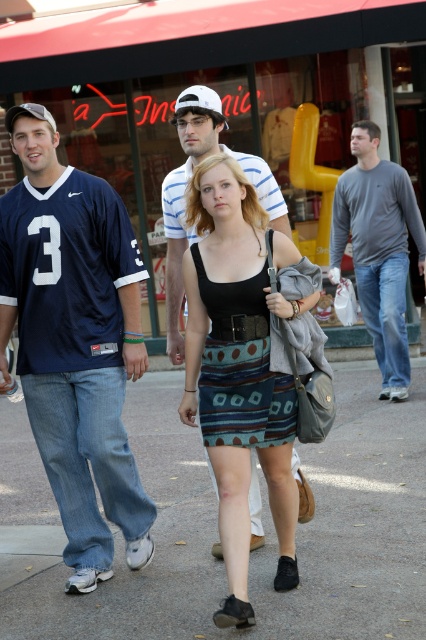
Question: Estimate the real-world distances between objects in this image. Which object is closer to the gray concrete pavement at center?

Choices:
 (A) navy blue jersey at center
 (B) black fabric sandal at lower center
 (C) striped cotton shirt at center

Answer: (B)

Question: Can you confirm if navy blue jersey at center is bigger than matte black tank top at center?

Choices:
 (A) yes
 (B) no

Answer: (B)

Question: Which object appears farthest from the camera in this image?

Choices:
 (A) black fabric sandal at lower center
 (B) white matte baseball cap at center
 (C) navy blue jersey at center
 (D) striped cotton shirt at center

Answer: (B)

Question: Is gray cotton shirt at center thinner than black fabric sandal at lower center?

Choices:
 (A) no
 (B) yes

Answer: (A)

Question: Which object is farther from the camera taking this photo?

Choices:
 (A) navy blue jersey at center
 (B) striped cotton shirt at center
 (C) gray cotton shirt at center
 (D) gray concrete pavement at center

Answer: (C)

Question: Is matte black tank top at center above striped cotton shirt at center?

Choices:
 (A) yes
 (B) no

Answer: (B)